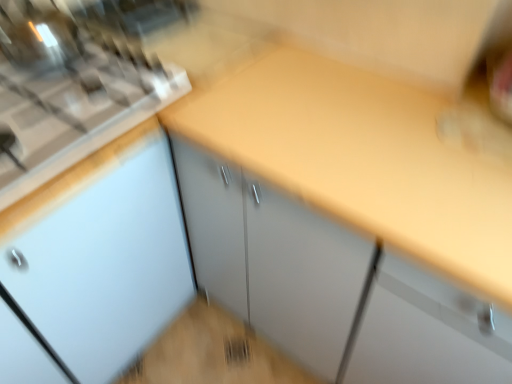
Question: Does satin silver gas stove at upper left turn towards yellow laminate countertop at center?

Choices:
 (A) yes
 (B) no

Answer: (B)

Question: Is yellow laminate countertop at center at the back of satin silver gas stove at upper left?

Choices:
 (A) yes
 (B) no

Answer: (B)

Question: Can you confirm if satin silver gas stove at upper left is taller than yellow laminate countertop at center?

Choices:
 (A) no
 (B) yes

Answer: (A)

Question: Does satin silver gas stove at upper left have a larger size compared to yellow laminate countertop at center?

Choices:
 (A) no
 (B) yes

Answer: (A)

Question: Does satin silver gas stove at upper left have a lesser width compared to yellow laminate countertop at center?

Choices:
 (A) yes
 (B) no

Answer: (A)

Question: Would you say satin silver gas stove at upper left contains yellow laminate countertop at center?

Choices:
 (A) yes
 (B) no

Answer: (B)

Question: Is yellow laminate countertop at center taller than satin silver gas stove at upper left?

Choices:
 (A) yes
 (B) no

Answer: (A)

Question: Considering the relative positions of yellow laminate countertop at center and satin silver gas stove at upper left in the image provided, is yellow laminate countertop at center to the left of satin silver gas stove at upper left from the viewer's perspective?

Choices:
 (A) no
 (B) yes

Answer: (A)

Question: Considering the relative sizes of yellow laminate countertop at center and satin silver gas stove at upper left in the image provided, is yellow laminate countertop at center bigger than satin silver gas stove at upper left?

Choices:
 (A) yes
 (B) no

Answer: (A)

Question: Is satin silver gas stove at upper left completely or partially inside yellow laminate countertop at center?

Choices:
 (A) no
 (B) yes

Answer: (A)

Question: From a real-world perspective, is yellow laminate countertop at center over satin silver gas stove at upper left?

Choices:
 (A) yes
 (B) no

Answer: (B)

Question: Considering the relative sizes of yellow laminate countertop at center and satin silver gas stove at upper left in the image provided, is yellow laminate countertop at center thinner than satin silver gas stove at upper left?

Choices:
 (A) yes
 (B) no

Answer: (B)

Question: Is point (109, 46) closer or farther from the camera than point (384, 79)?

Choices:
 (A) farther
 (B) closer

Answer: (A)